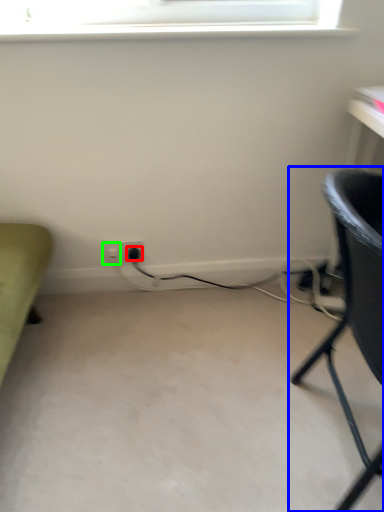
Question: Which object is positioned closest to plug (highlighted by a red box)? Select from chair (highlighted by a blue box) and electric outlet (highlighted by a green box).

Choices:
 (A) chair
 (B) electric outlet

Answer: (B)